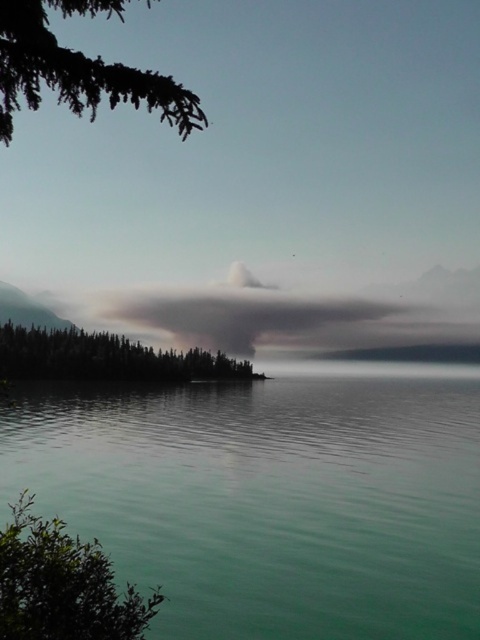
Between green leafy bush at lower left and green leafy branch at upper left, which one appears on the right side from the viewer's perspective?

From the viewer's perspective, green leafy bush at lower left appears more on the right side.

Find the location of `green leafy bush at lower left`. green leafy bush at lower left is located at coordinates (62, 584).

This screenshot has width=480, height=640. Find the location of `green leafy bush at lower left`. green leafy bush at lower left is located at coordinates (62, 584).

Is green leafy bush at lower left above green matte trees at left?

Correct, green leafy bush at lower left is located above green matte trees at left.

Does point (60, 525) lie behind point (64, 349)?

That is False.

Locate an element on the screen. Image resolution: width=480 pixels, height=640 pixels. green leafy bush at lower left is located at coordinates (62, 584).

Which is in front, point (131, 68) or point (85, 342)?

Positioned in front is point (131, 68).

Is green leafy branch at upper left in front of green matte trees at left?

That is True.

Where is `green leafy branch at upper left`? The image size is (480, 640). green leafy branch at upper left is located at coordinates (79, 68).

Where is `green leafy branch at upper left`? The height and width of the screenshot is (640, 480). green leafy branch at upper left is located at coordinates (79, 68).